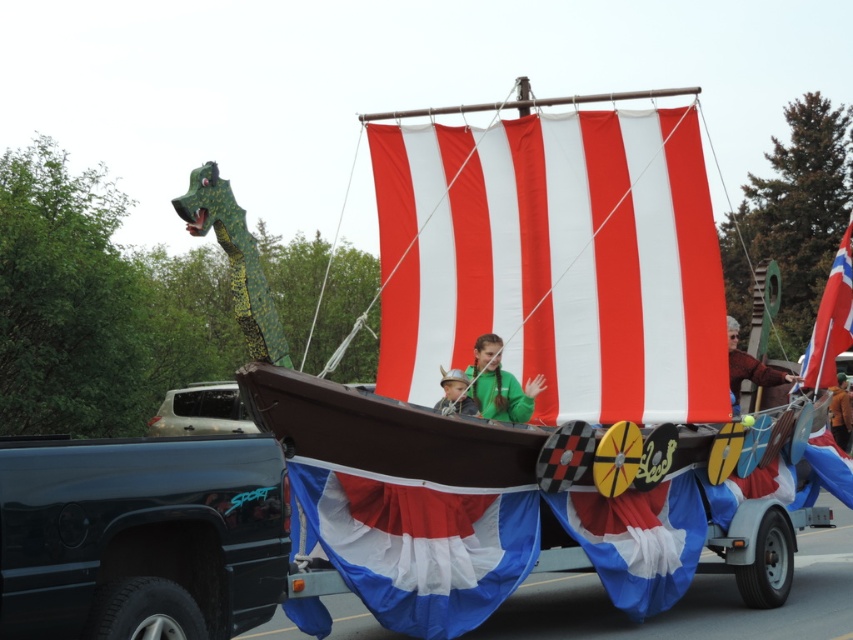
You are a parade attendee standing on the sidewalk. You see the blue and white fabric flag at lower center and the blue fabric sail at center on the Viking float. How far apart are these two blue items?

The blue and white fabric flag at lower center and the blue fabric sail at center are 3.69 feet apart from each other.

You are a parade organizer who needs to ensure the blue and white fabric flag at lower center is visible to the crowd. The flag is 2 meters tall. The parade route has a 3 meter height restriction. Is the flag compliant with the height restriction?

The blue and white fabric flag at lower center is 6.67 meters apart from the height restriction measurement point. Since the flag is only 2 meters tall, it is well within the 3 meter height limit and compliant with the parade regulations.